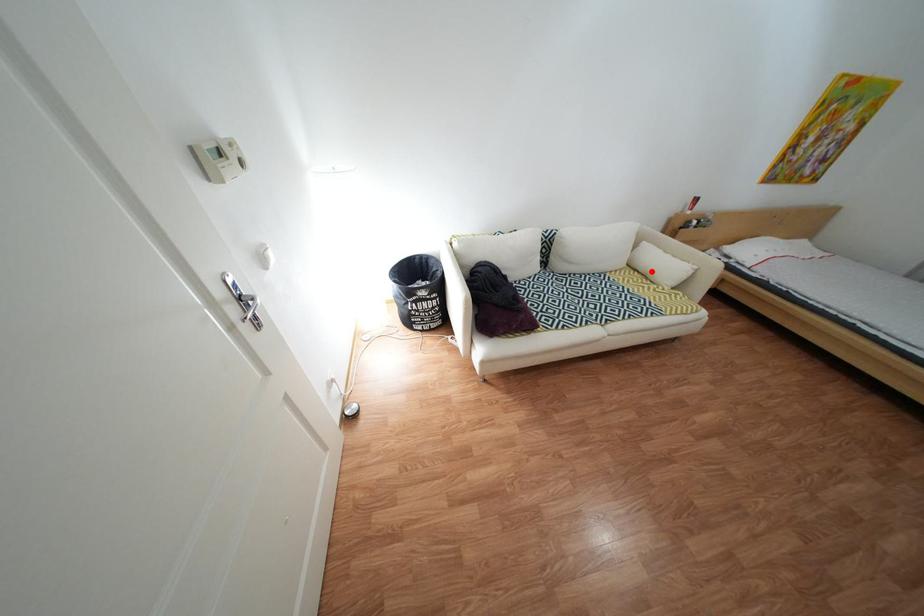
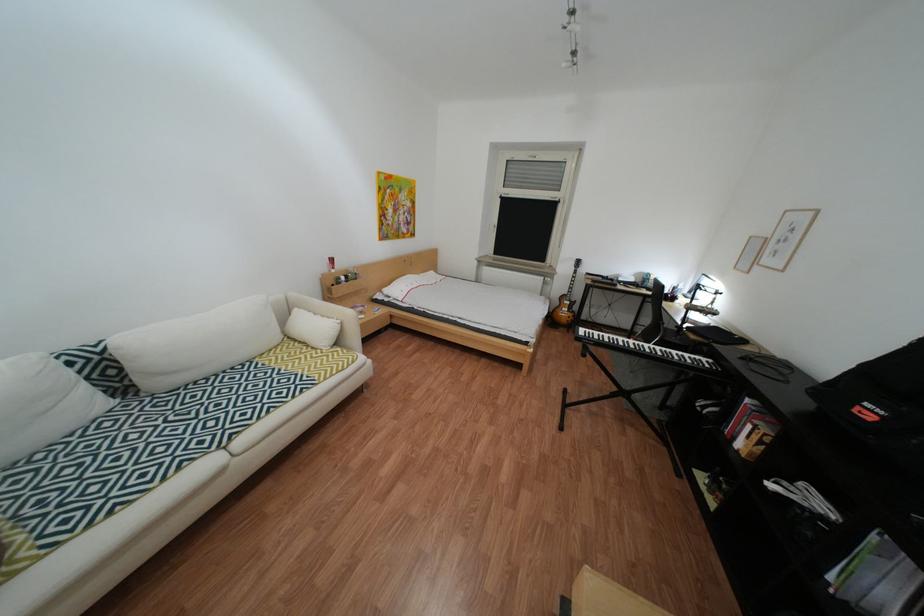
Where in the second image is the point corresponding to the highlighted location from the first image?

(311, 342)